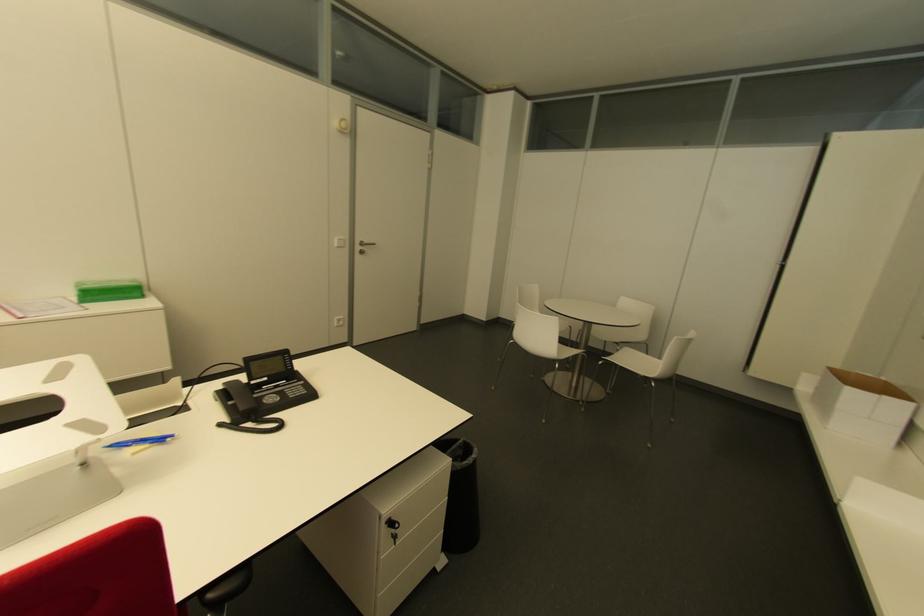
The height and width of the screenshot is (616, 924). In order to click on telephone handset in this screenshot , I will do `click(237, 402)`.